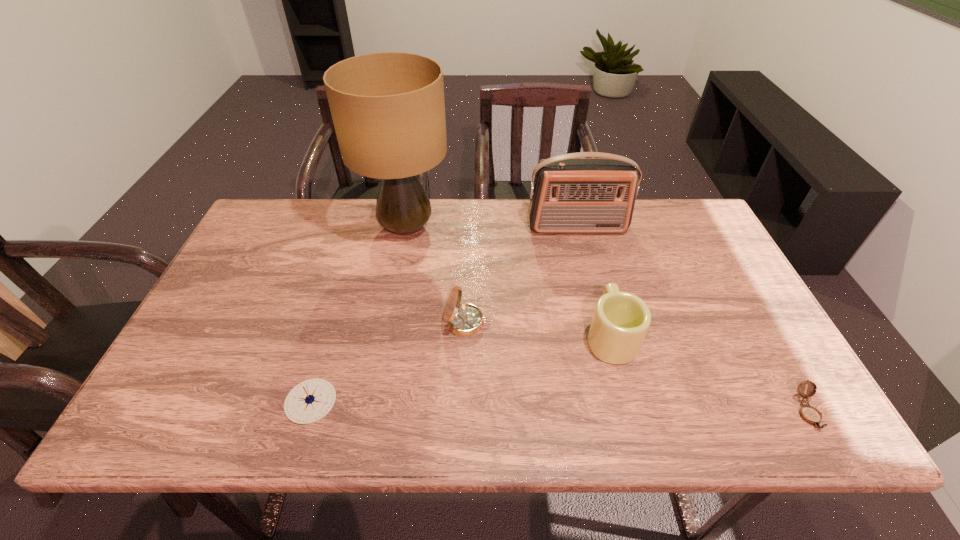
The height and width of the screenshot is (540, 960). I want to click on vacant position located with the handle on the side of the mug, so click(x=589, y=254).

Where is `vacant position located with the handle on the side of the mug`? The height and width of the screenshot is (540, 960). vacant position located with the handle on the side of the mug is located at coordinates (584, 233).

This screenshot has height=540, width=960. In order to click on vacant space located 0.300m with the dial facing the tallest compass in this screenshot , I will do `click(609, 323)`.

At what (x,y) coordinates should I click in order to perform the action: click on free space located 0.280m on the back of the leftmost compass. Please return your answer as a coordinate pair (x, y). This screenshot has width=960, height=540. Looking at the image, I should click on (344, 289).

Locate an element on the screen. This screenshot has width=960, height=540. lampshade located in the far edge section of the desktop is located at coordinates (388, 109).

Identify the location of radio receiver that is at the far edge. (569, 194).

Locate an element on the screen. object at the right edge is located at coordinates (811, 415).

The image size is (960, 540). Identify the location of object that is at the near right corner. (811, 415).

In the image, there is a desktop. Where is `free space at the far edge`? free space at the far edge is located at coordinates (642, 212).

I want to click on free space at the near edge of the desktop, so (247, 399).